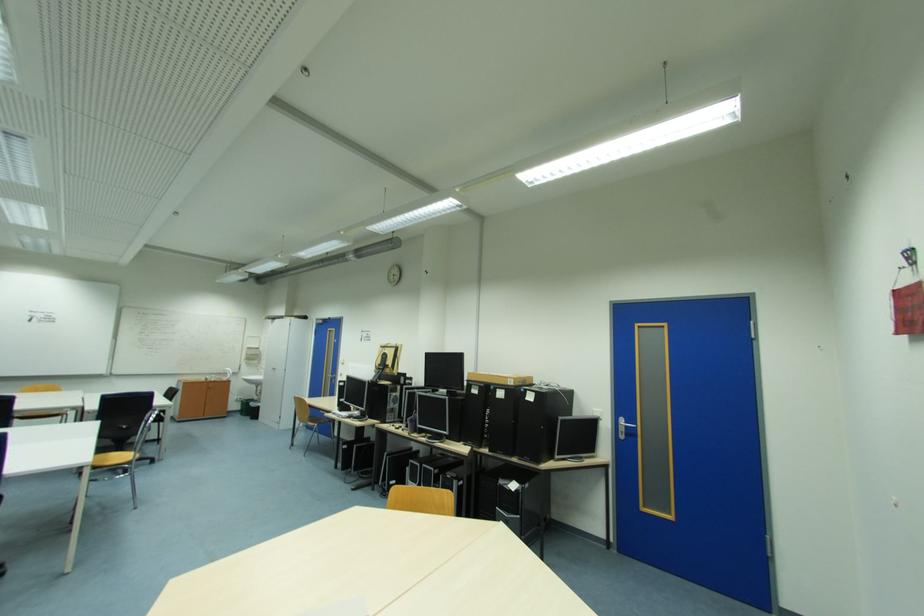
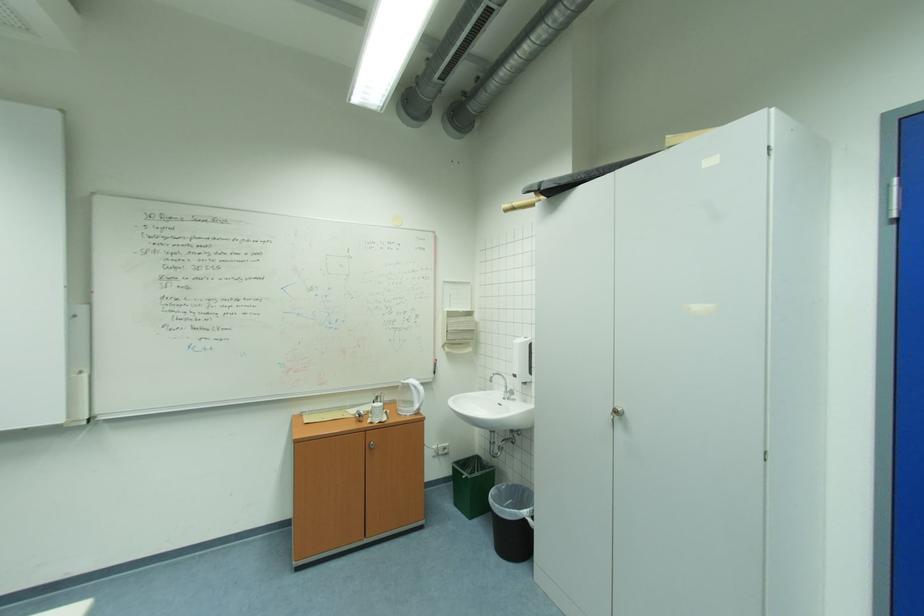
Find the pixel in the second image that matches (x=249, y=416) in the first image.

(464, 505)